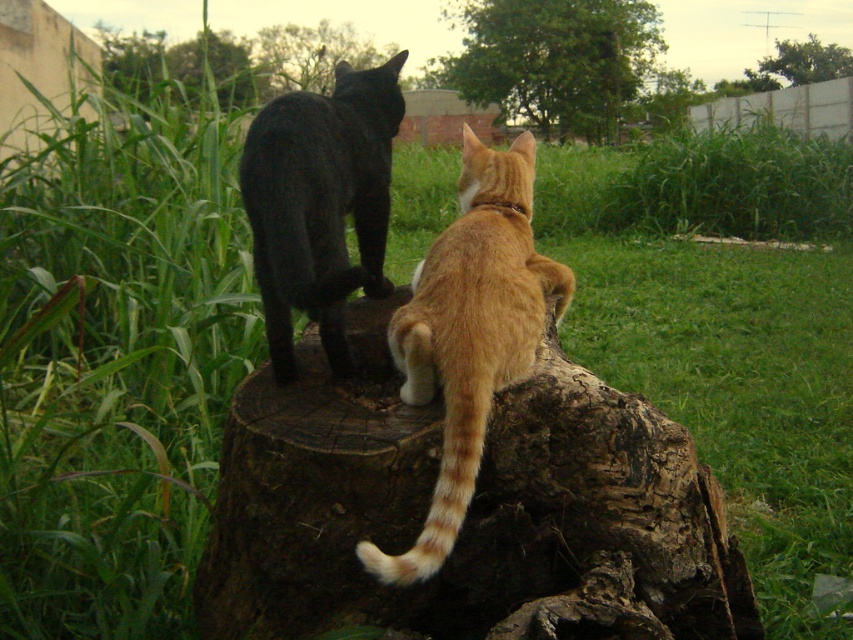
Question: Is brown rough tree trunk at center wider than black glossy cat at upper center?

Choices:
 (A) no
 (B) yes

Answer: (B)

Question: Based on their relative distances, which object is nearer to the brown rough tree trunk at center?

Choices:
 (A) orange tabby cat at center
 (B) black glossy cat at upper center

Answer: (A)

Question: Considering the relative positions of brown rough tree trunk at center and orange tabby cat at center in the image provided, where is brown rough tree trunk at center located with respect to orange tabby cat at center?

Choices:
 (A) below
 (B) above

Answer: (A)

Question: In this image, where is orange tabby cat at center located relative to black glossy cat at upper center?

Choices:
 (A) right
 (B) left

Answer: (A)

Question: Estimate the real-world distances between objects in this image. Which object is farther from the brown rough tree trunk at center?

Choices:
 (A) black glossy cat at upper center
 (B) orange tabby cat at center

Answer: (A)

Question: Which point appears farthest from the camera in this image?

Choices:
 (A) (567, 284)
 (B) (335, 256)
 (C) (235, 456)

Answer: (A)